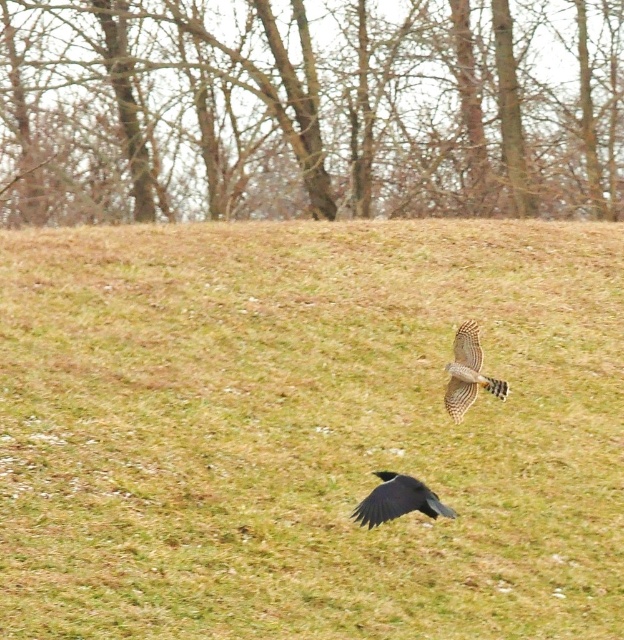
You are a small animal hiding in the green grass at center. You want to climb to the top of the brown bark trees at upper center to get a better view. Is the grass shorter than the trees?

The green grass at center has a lesser height compared to brown bark trees at upper center, so yes, the grass is shorter than the trees.

You are an ornithologist studying bird flight patterns in a grassy field. You observe two birds in the scene. The first bird is a crow flying low over the ground, and the second is a hawk flying above it. You need to determine the relative height of the birds compared to the brown bark trees at upper center. Which bird is closer to the trees?

The hawk is closer to the brown bark trees at upper center because it is flying above the crow, which is lower near the ground, so the hawk is higher up near the trees.

In the scene shown: You are a photographer trying to capture the black glossy bird at lower center and the green grass at center in your shot. From the perspective of the camera, which object is positioned to the left?

The green grass at center is to the left of the black glossy bird at lower center, so the green grass at center appears on the left side of the camera frame.